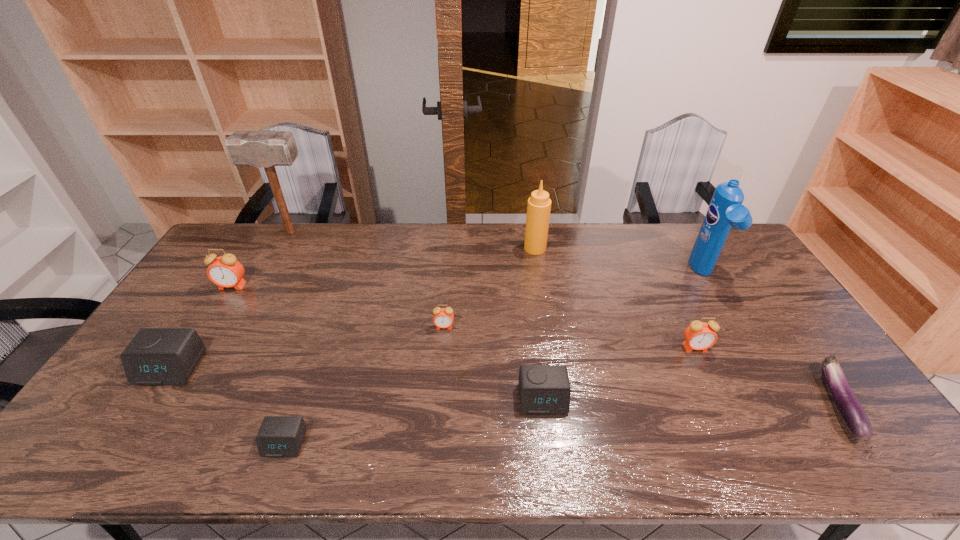
The width and height of the screenshot is (960, 540). Identify the location of vacant space in between the second smallest black alarm clock and the ninth object from left to right. coord(623,336).

Where is `vacant area that lies between the leftmost black alarm clock and the rightmost black alarm clock`? The image size is (960, 540). vacant area that lies between the leftmost black alarm clock and the rightmost black alarm clock is located at coordinates (356, 383).

Image resolution: width=960 pixels, height=540 pixels. In order to click on object that stands as the second closest to the condiment in this screenshot , I will do `click(725, 210)`.

Where is `object that stands as the third closest to the tallest alarm clock`? The height and width of the screenshot is (540, 960). object that stands as the third closest to the tallest alarm clock is located at coordinates (279, 436).

The width and height of the screenshot is (960, 540). Identify the location of alarm clock that stands as the fourth closest to the third alarm clock from right to left. 225,271.

Identify which alarm clock is the fourth nearest to the second farthest alarm clock. Please provide its 2D coordinates. Your answer should be formatted as a tuple, i.e. [(x, y)], where the tuple contains the x and y coordinates of a point satisfying the conditions above.

[(225, 271)]

You are a GUI agent. You are given a task and a screenshot of the screen. Output one action in this format:
    pyautogui.click(x=<x>, y=<y>)
    Task: Click on the closest pink alarm clock to the mallet
    The height and width of the screenshot is (540, 960).
    Given the screenshot: What is the action you would take?
    pyautogui.click(x=225, y=271)

The height and width of the screenshot is (540, 960). What are the coordinates of `the closest pink alarm clock to the second farthest object` in the screenshot? It's located at (443, 317).

Image resolution: width=960 pixels, height=540 pixels. Find the location of `the second closest black alarm clock to the fourth alarm clock from right to left`. the second closest black alarm clock to the fourth alarm clock from right to left is located at coordinates (544, 389).

Identify which black alarm clock is located as the nearest to the seventh object from right to left. Please provide its 2D coordinates. Your answer should be formatted as a tuple, i.e. [(x, y)], where the tuple contains the x and y coordinates of a point satisfying the conditions above.

[(155, 356)]